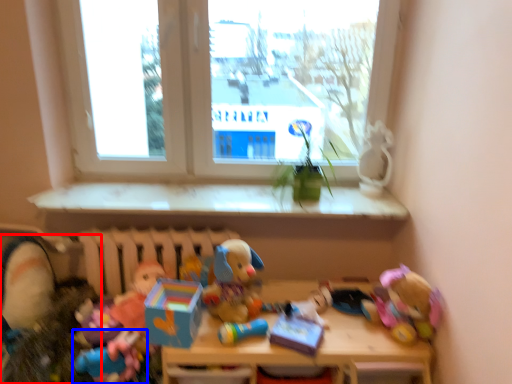
Question: Which object is further to the camera taking this photo, toy (highlighted by a red box) or toy (highlighted by a blue box)?

Choices:
 (A) toy
 (B) toy

Answer: (B)